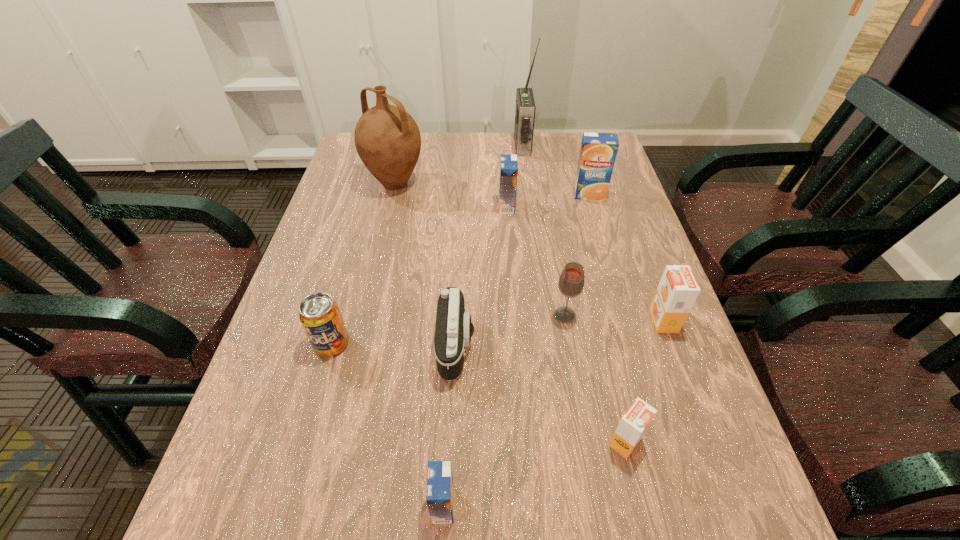
Identify the location of orange_juice that can be found as the third closest to the glass drink container. (508, 173).

The width and height of the screenshot is (960, 540). In order to click on the closest blue orange_juice to the second nearest orange_juice in this screenshot , I will do `click(440, 489)`.

Locate an element on the screen. This screenshot has height=540, width=960. the second closest blue orange_juice to the rightmost blue orange_juice is located at coordinates (440, 489).